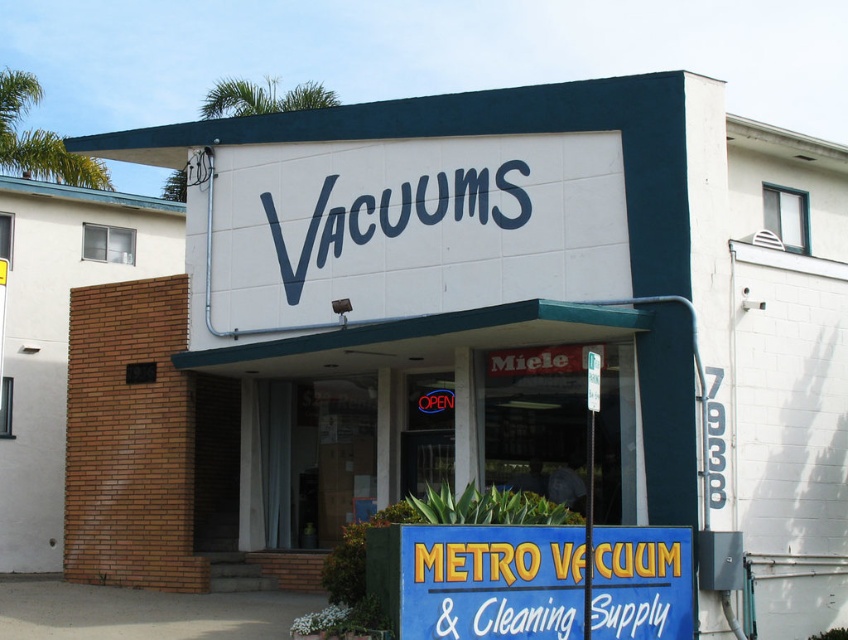
Question: Which of the following is the farthest from the observer?

Choices:
 (A) white plastic sign at lower center
 (B) blue plastic sign at center
 (C) blue painted sign at center

Answer: (C)

Question: Where is blue plastic sign at center located in relation to white plastic sign at lower center in the image?

Choices:
 (A) below
 (B) above

Answer: (B)

Question: Which point is farther to the camera?

Choices:
 (A) (341, 234)
 (B) (687, 627)
 (C) (640, 632)

Answer: (A)

Question: Is blue plastic sign at center thinner than white plastic sign at lower center?

Choices:
 (A) no
 (B) yes

Answer: (A)

Question: Does blue plastic sign at center have a larger size compared to blue painted sign at center?

Choices:
 (A) yes
 (B) no

Answer: (B)

Question: Among these objects, which one is farthest from the camera?

Choices:
 (A) white plastic sign at lower center
 (B) blue plastic sign at center
 (C) blue painted sign at center

Answer: (C)